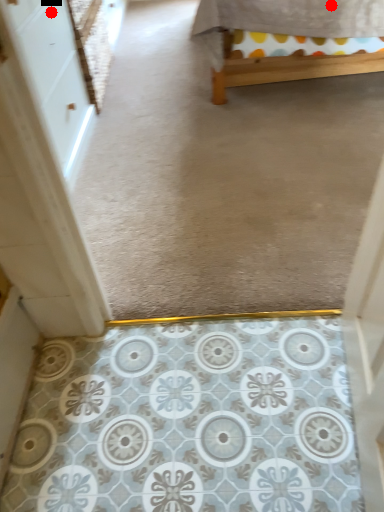
Question: Two points are circled on the image, labeled by A and B beside each circle. Which of the following is the closest to the observer?

Choices:
 (A) A is closer
 (B) B is closer

Answer: (B)